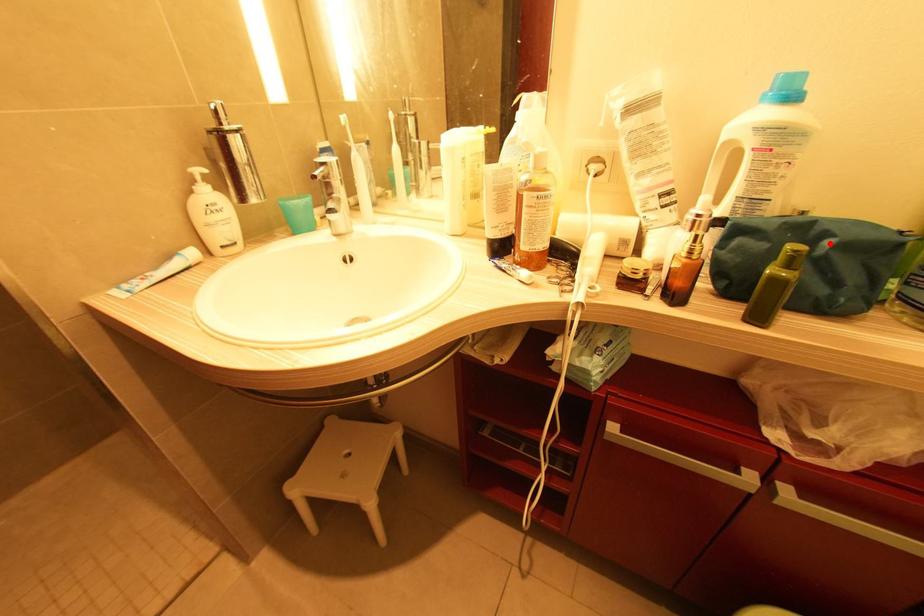
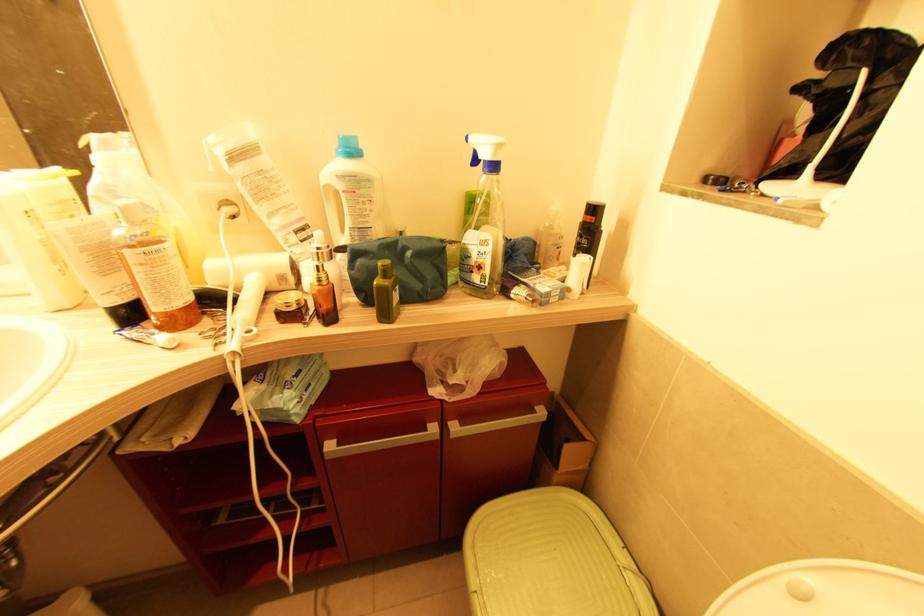
Where in the second image is the point corresponding to the highlighted location from the first image?

(409, 254)